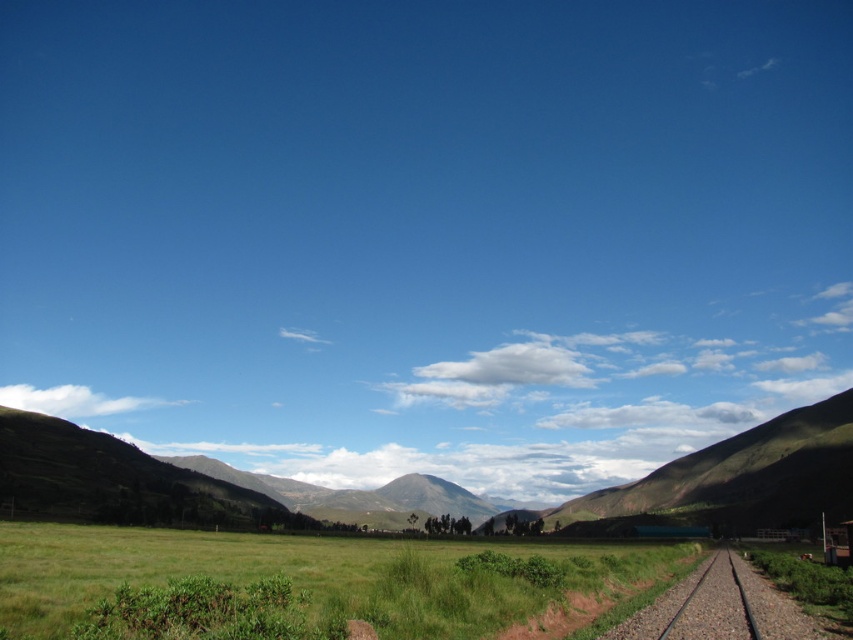
Is green grassy field at lower center in front of smooth metal train track at lower right?

Yes, green grassy field at lower center is closer to the viewer.

Is point (412, 586) in front of point (726, 634)?

No, it is not.

You are a GUI agent. You are given a task and a screenshot of the screen. Output one action in this format:
    pyautogui.click(x=<x>, y=<y>)
    Task: Click on the green grassy field at lower center
    
    Given the screenshot: What is the action you would take?
    pyautogui.click(x=308, y=573)